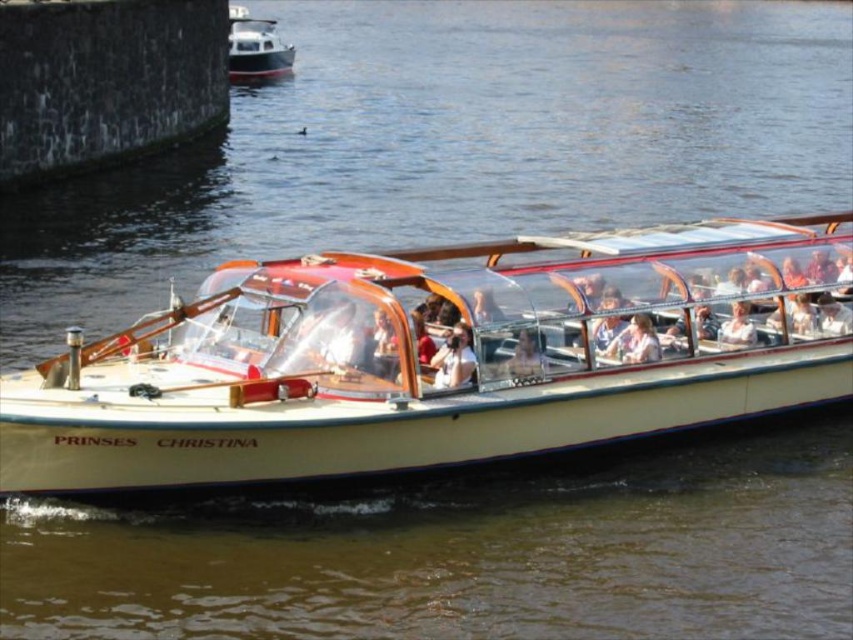
Question: Which of these objects is positioned closest to the light beige fabric jacket at center?

Choices:
 (A) matte white shirt at center
 (B) light brown leather jacket at center
 (C) white glossy boat at upper left

Answer: (B)

Question: Can you confirm if light beige wood boat at center is positioned to the right of matte white shirt at center?

Choices:
 (A) no
 (B) yes

Answer: (A)

Question: Is white polished wood boat at center smaller than white glossy boat at upper left?

Choices:
 (A) no
 (B) yes

Answer: (B)

Question: Can you confirm if light brown leather jacket at center is smaller than light beige fabric jacket at center?

Choices:
 (A) yes
 (B) no

Answer: (B)

Question: Estimate the real-world distances between objects in this image. Which object is closer to the light beige fabric jacket at center?

Choices:
 (A) white glossy boat at upper left
 (B) light beige wood boat at center

Answer: (B)

Question: Which object is farther from the camera taking this photo?

Choices:
 (A) light brown leather jacket at center
 (B) white glossy boat at upper left
 (C) matte white shirt at center
 (D) light beige wood boat at center

Answer: (B)